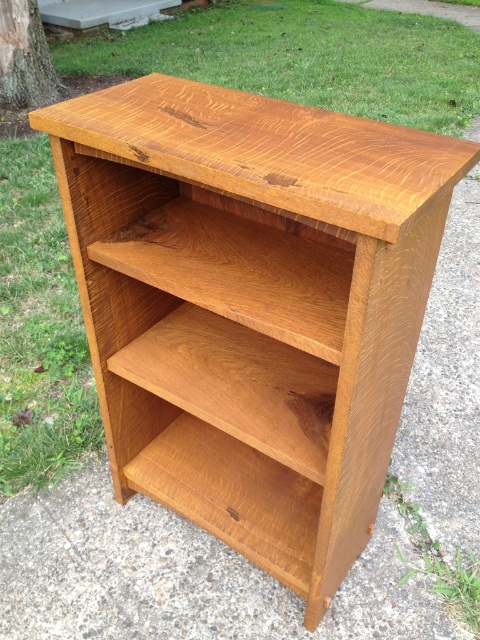
Question: Considering the relative positions of light brown wood at center and light brown wood drawer at center in the image provided, where is light brown wood at center located with respect to light brown wood drawer at center?

Choices:
 (A) above
 (B) below

Answer: (A)

Question: Which object is farther from the camera taking this photo?

Choices:
 (A) light brown wood at center
 (B) light brown wood drawer at center

Answer: (B)

Question: Does light brown wood at center appear under light brown wood drawer at center?

Choices:
 (A) yes
 (B) no

Answer: (B)

Question: Can you confirm if light brown wood at center is thinner than light brown wood drawer at center?

Choices:
 (A) no
 (B) yes

Answer: (A)

Question: Which of the following is the closest to the observer?

Choices:
 (A) (230, 500)
 (B) (175, 403)

Answer: (B)